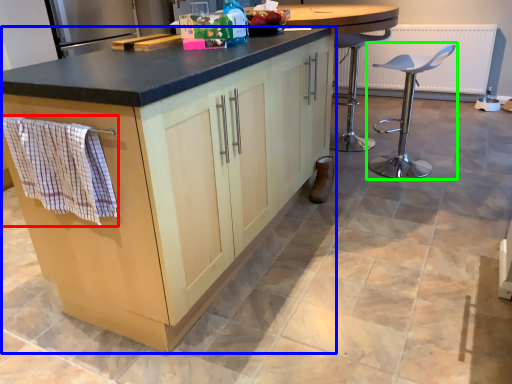
Question: Considering the real-world distances, which object is closest to hand towel (highlighted by a red box)? cabinetry (highlighted by a blue box) or chair (highlighted by a green box).

Choices:
 (A) cabinetry
 (B) chair

Answer: (A)